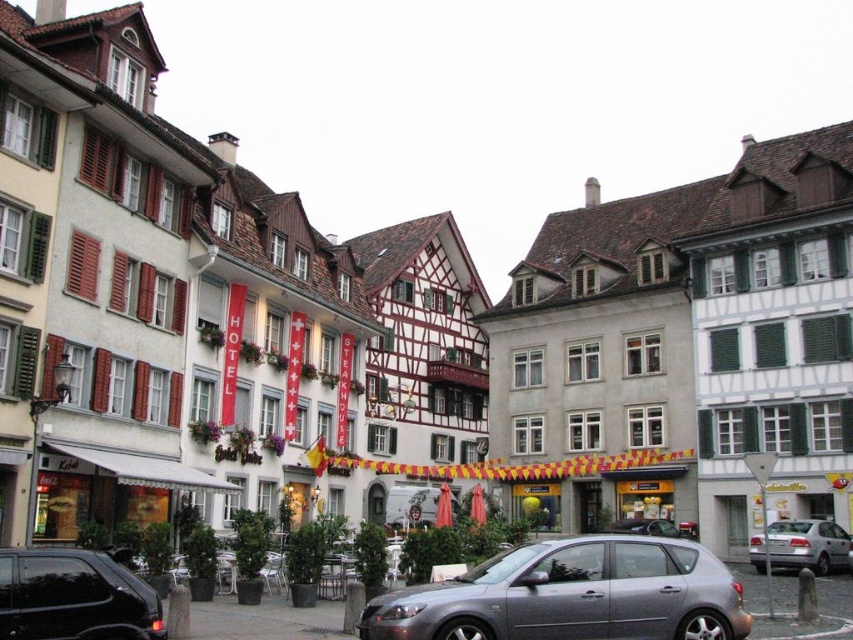
You are a delivery driver needing to park your van between the shiny black car at lower left and the silver metallic hatchback at center. The van is 5 meters long. Can you fit it between them?

The distance between the shiny black car at lower left and the silver metallic hatchback at center is 49.12 meters. Since the van is only 5 meters long, there is ample space to park between them.

You are a delivery person needing to park your 1.8 meters wide motorcycle between the shiny black car at lower left and the silver metallic sedan at lower right. Can you fit your motorcycle in the space between them?

The shiny black car at lower left is thinner than the silver metallic sedan at lower right, but the description does not provide the exact width of the space between them. Therefore, it is unclear if the motorcycle can fit.